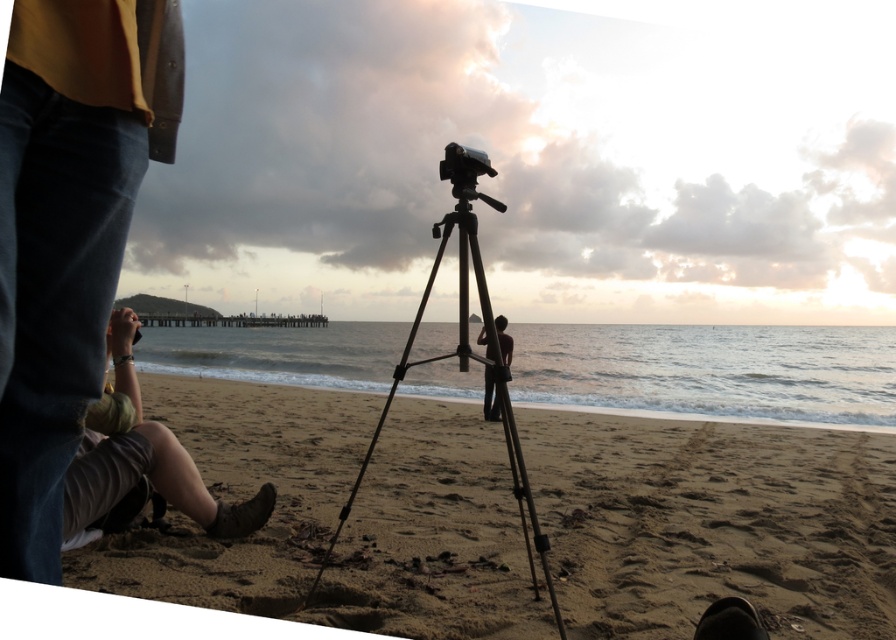
Can you confirm if sandy beach at lower center is positioned below metallic tripod at center?

Indeed, sandy beach at lower center is positioned under metallic tripod at center.

Between point (688, 506) and point (505, 376), which one is positioned in front?

Point (505, 376) is in front.

Describe the element at coordinates (713, 522) in the screenshot. I see `sandy beach at lower center` at that location.

Find the location of a particular element. Image resolution: width=896 pixels, height=640 pixels. sandy beach at lower center is located at coordinates [713, 522].

Is the position of metallic tripod at center less distant than that of dark brown leather pants at center?

No.

Which is more to the left, metallic tripod at center or dark brown leather pants at center?

metallic tripod at center

Measure the distance between metallic tripod at center and camera.

metallic tripod at center and camera are 4.56 meters apart.

This screenshot has height=640, width=896. Identify the location of metallic tripod at center. (464, 371).

Measure the distance between point (235, 445) and camera.

Point (235, 445) is 29.74 feet from camera.

Does sandy beach at lower center have a smaller size compared to dark brown leather pants at center?

Incorrect, sandy beach at lower center is not smaller in size than dark brown leather pants at center.

Is point (524, 600) farther from camera compared to point (489, 417)?

No, it is in front of (489, 417).

The width and height of the screenshot is (896, 640). I want to click on sandy beach at lower center, so click(x=713, y=522).